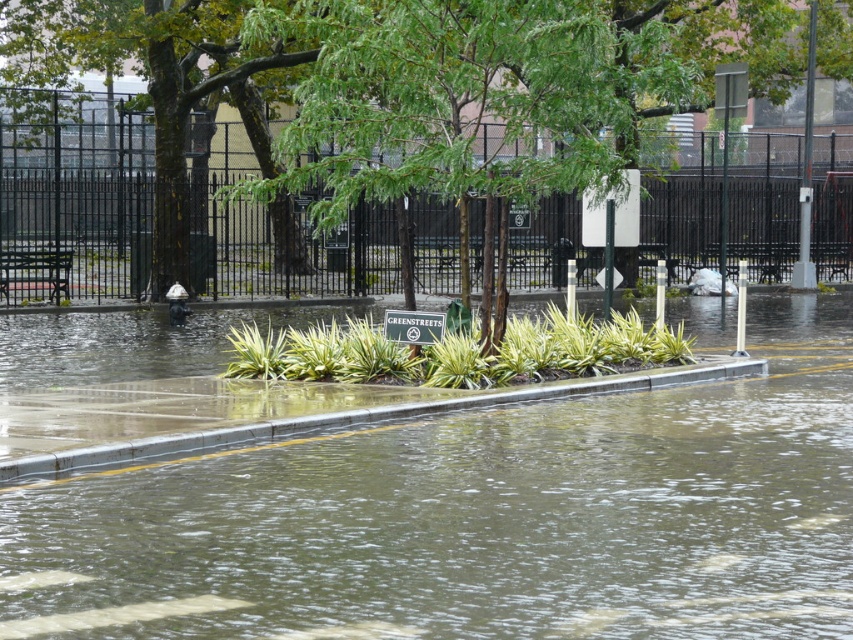
Does brown muddy water at center appear on the left side of green leafy tree at center?

Incorrect, brown muddy water at center is not on the left side of green leafy tree at center.

Can you confirm if brown muddy water at center is taller than green leafy tree at center?

In fact, brown muddy water at center may be shorter than green leafy tree at center.

Describe the element at coordinates (483, 518) in the screenshot. This screenshot has width=853, height=640. I see `brown muddy water at center` at that location.

This screenshot has height=640, width=853. In order to click on brown muddy water at center in this screenshot , I will do `click(483, 518)`.

Does green leafy tree at center have a smaller size compared to concrete at lower center?

No, green leafy tree at center is not smaller than concrete at lower center.

Who is lower down, green leafy tree at center or concrete at lower center?

concrete at lower center

Identify the location of green leafy tree at center. (398, 88).

Is brown muddy water at center thinner than concrete at lower center?

Incorrect, brown muddy water at center's width is not less than concrete at lower center's.

Is point (804, 304) more distant than point (4, 472)?

Yes, it is.

Identify the location of brown muddy water at center. This screenshot has height=640, width=853. (483, 518).